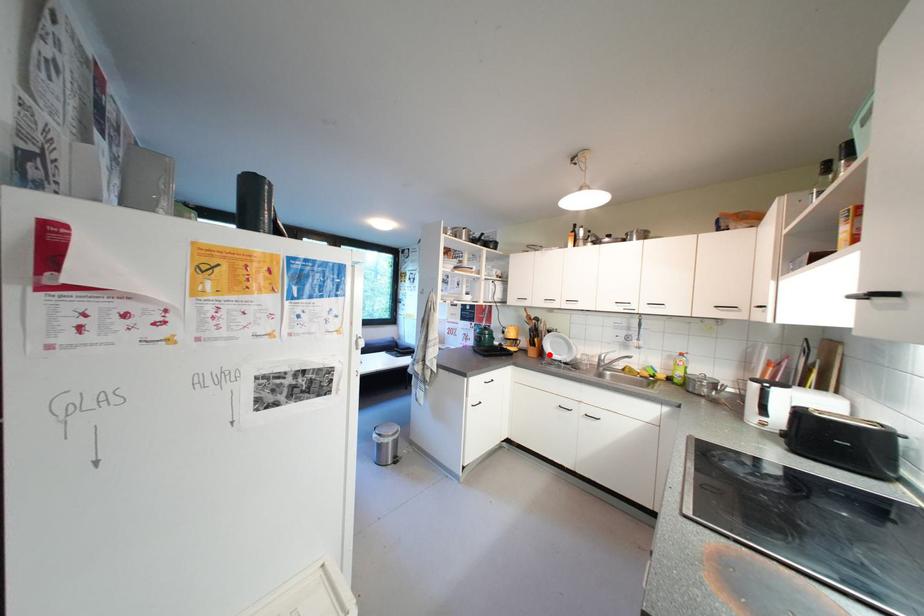
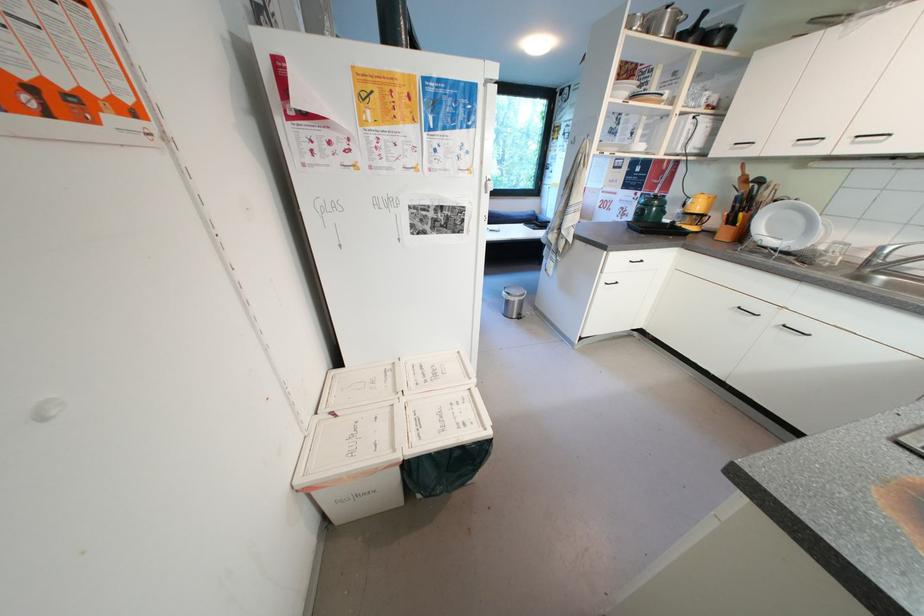
Locate, in the second image, the point that corresponds to the highlighted location in the first image.

(749, 238)